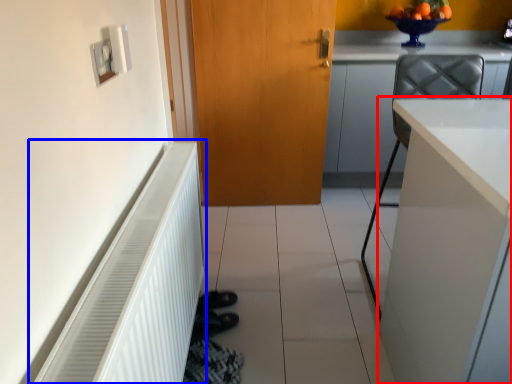
Question: Which point is closer to the camera, cabinetry (highlighted by a red box) or radiator (highlighted by a blue box)?

Choices:
 (A) cabinetry
 (B) radiator

Answer: (B)